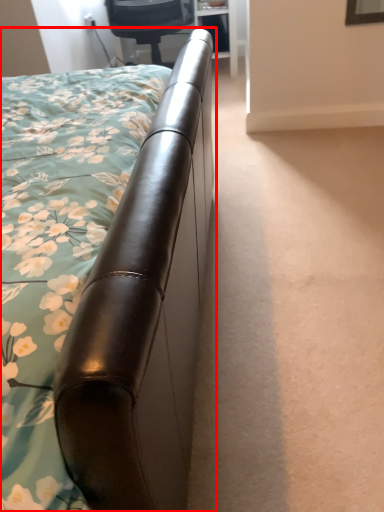
Question: From the image's perspective, where is bed (annotated by the red box) located in relation to chair in the image?

Choices:
 (A) above
 (B) below

Answer: (B)